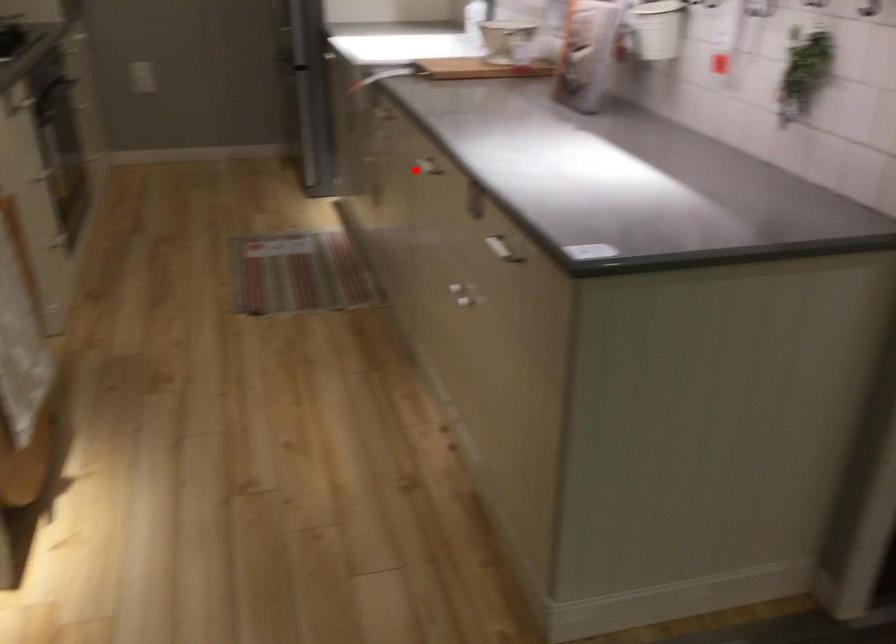
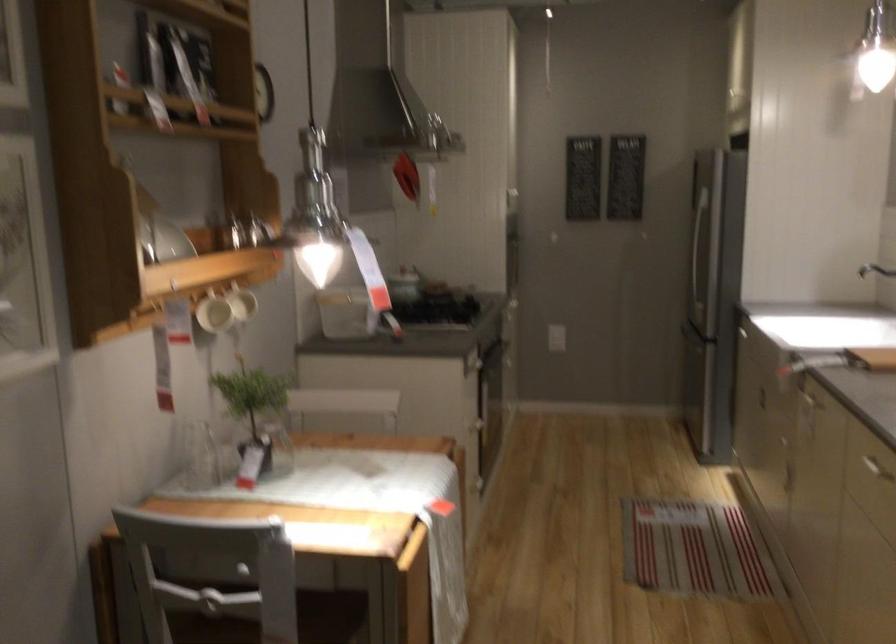
Question: I am providing you with two images of the same scene from different viewpoints. Given a red point in image1, look at the same physical point in image2. Is it:

Choices:
 (A) Closer to the viewpoint
 (B) Farther from the viewpoint

Answer: (A)